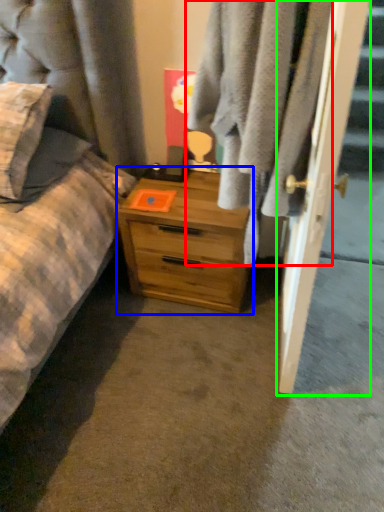
Question: Which object is positioned closest to clothing (highlighted by a red box)? Select from chest of drawers (highlighted by a blue box) and door (highlighted by a green box).

Choices:
 (A) chest of drawers
 (B) door

Answer: (B)